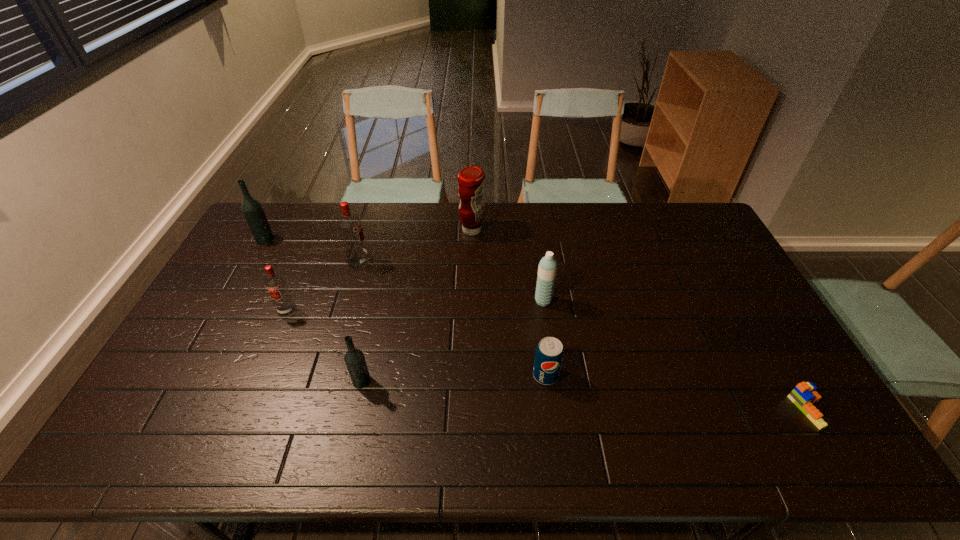
Where is `vacant space at the far edge`? Image resolution: width=960 pixels, height=540 pixels. vacant space at the far edge is located at coordinates (500, 217).

Find the location of a particular element. free region at the left edge of the desktop is located at coordinates (227, 264).

Locate an element on the screen. vacant point at the right edge is located at coordinates (741, 280).

The image size is (960, 540). I want to click on vacant space at the near left corner of the desktop, so pos(113,457).

Find the location of a particular element. free spot between the nearest vodka and the orange Lego is located at coordinates (585, 395).

Locate an element on the screen. free space between the blue pop and the nearer black vodka is located at coordinates (454, 378).

The image size is (960, 540). In order to click on free space between the water bottle and the farther red vodka in this screenshot , I will do `click(451, 281)`.

You are a GUI agent. You are given a task and a screenshot of the screen. Output one action in this format:
    pyautogui.click(x=<x>, y=<y>)
    Task: Click on the vacant space in between the red condiment and the fourth object from left to right
    This screenshot has height=540, width=960.
    Given the screenshot: What is the action you would take?
    pyautogui.click(x=417, y=306)

The height and width of the screenshot is (540, 960). I want to click on free space between the farther red vodka and the orange Lego, so click(583, 335).

Identify the location of free point between the nearest vodka and the seventh object from right to left. (324, 346).